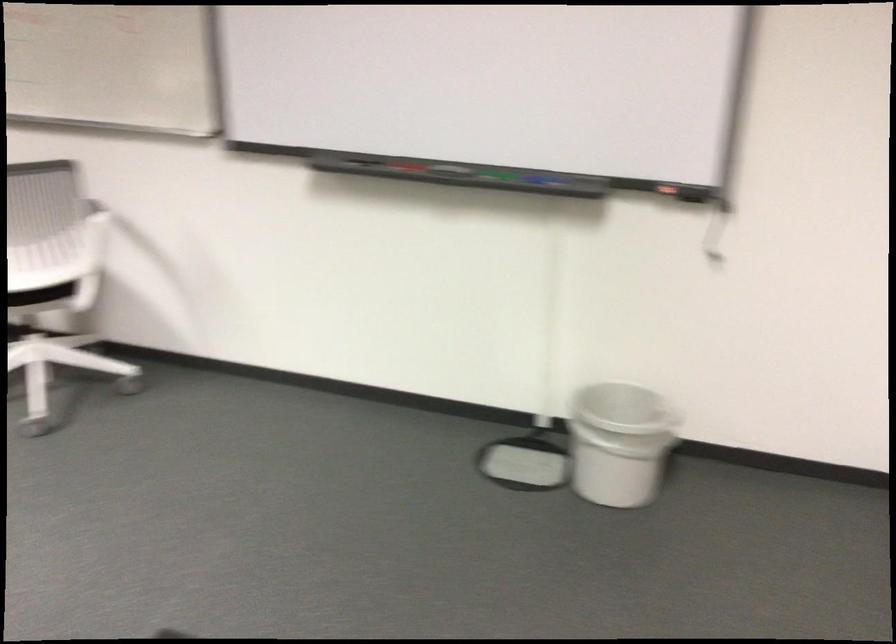
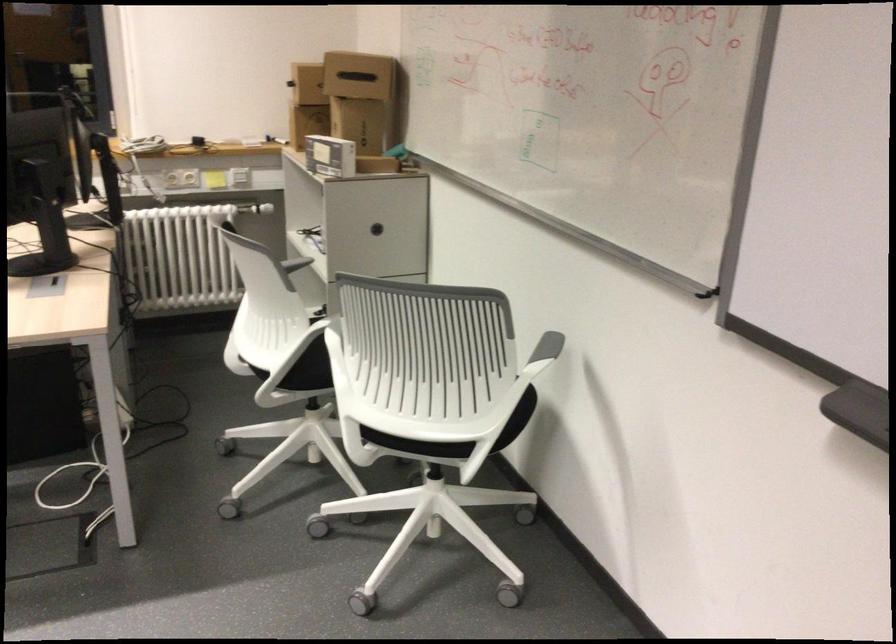
The point at (x=306, y=166) is marked in the first image. Where is the corresponding point in the second image?

(858, 411)